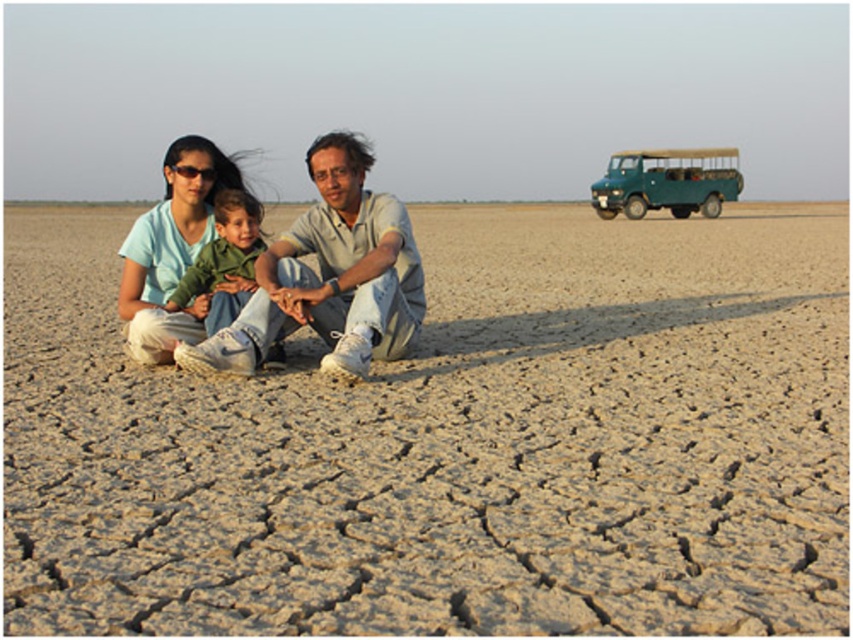
You are a hiker who needs to reach the green matte jeep at upper right. You are currently standing on the dried mud at center. Which direction should you move to get to the jeep?

The dried mud at center is located below the green matte jeep at upper right, so you should move upwards to reach the jeep.